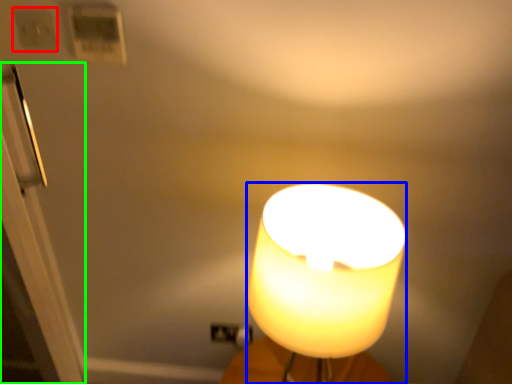
Question: Which object is the farthest from light switch (highlighted by a red box)? Choose among these: lamp (highlighted by a blue box) or door (highlighted by a green box).

Choices:
 (A) lamp
 (B) door

Answer: (A)